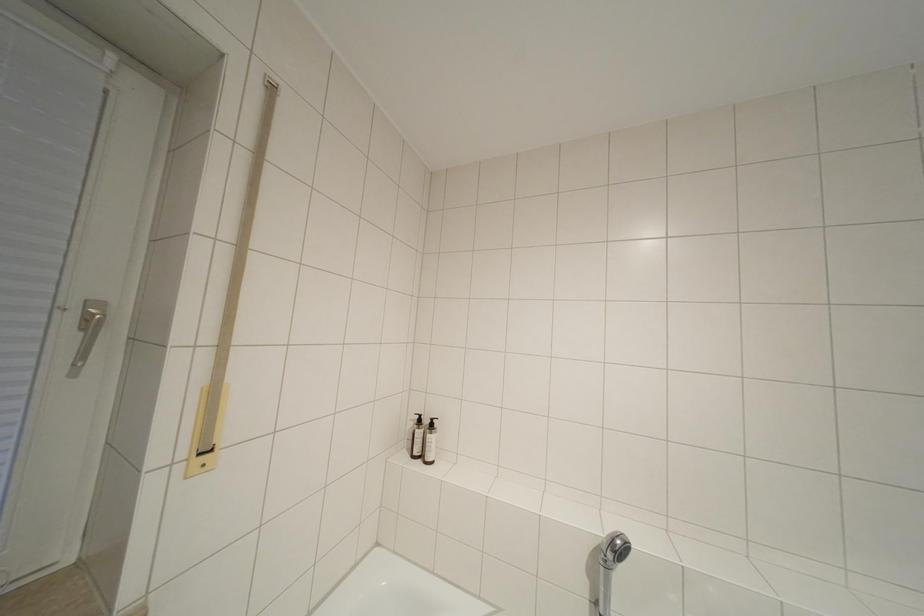
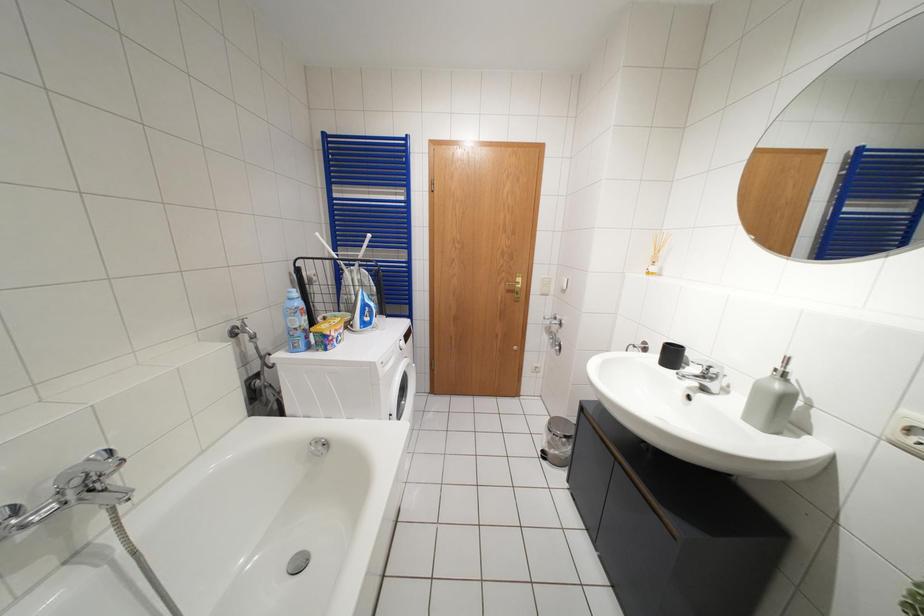
First-person continuous shooting, in which direction is the camera rotating?

The rotation direction of the camera is right-down.